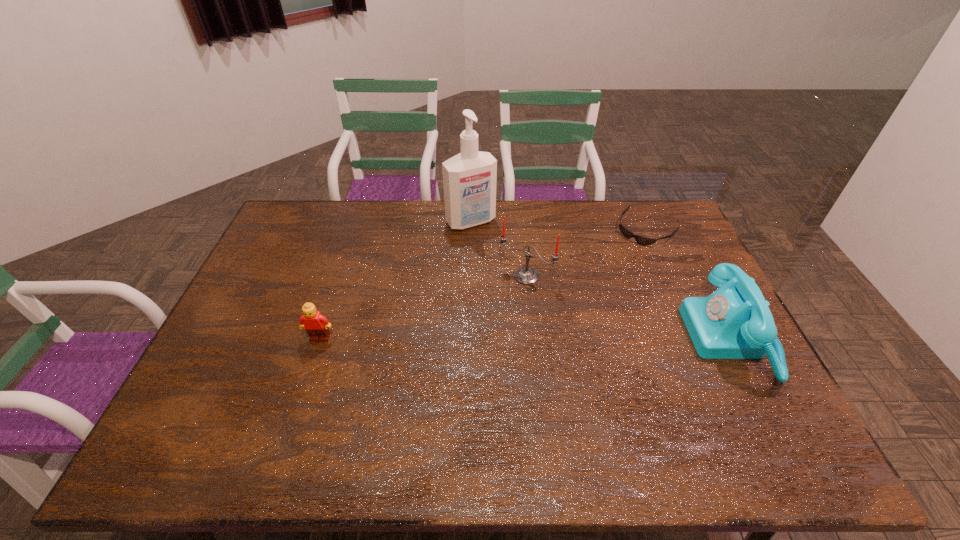
Where is `vacant area situated 0.060m on the front-facing side of the shortest object`? This screenshot has width=960, height=540. vacant area situated 0.060m on the front-facing side of the shortest object is located at coordinates (623, 251).

You are a GUI agent. You are given a task and a screenshot of the screen. Output one action in this format:
    pyautogui.click(x=<x>, y=<y>)
    Task: Click on the cleansing agent located in the far edge section of the desktop
    This screenshot has width=960, height=540.
    Given the screenshot: What is the action you would take?
    (469, 178)

This screenshot has height=540, width=960. What are the coordinates of `sunglasses present at the far edge` in the screenshot? It's located at (641, 240).

Identify the location of object that is at the near edge. (734, 322).

The width and height of the screenshot is (960, 540). In order to click on telephone that is at the right edge in this screenshot , I will do `click(734, 322)`.

Where is `sunglasses that is at the right edge`? The image size is (960, 540). sunglasses that is at the right edge is located at coordinates (641, 240).

The height and width of the screenshot is (540, 960). I want to click on object that is at the far right corner, so click(641, 240).

This screenshot has height=540, width=960. Find the location of `object that is at the near right corner`. object that is at the near right corner is located at coordinates (734, 322).

Identify the location of free space at the far edge. The width and height of the screenshot is (960, 540). (549, 208).

Identify the location of free space at the near edge of the desktop. Image resolution: width=960 pixels, height=540 pixels. (556, 405).